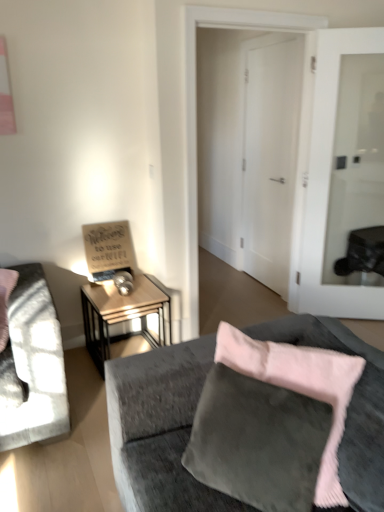
Question: Is wooden sign at left further to camera compared to white glass door at center, the 2th door from the left?

Choices:
 (A) yes
 (B) no

Answer: (A)

Question: Is wooden sign at left outside white glass door at center, the 2th door from the left?

Choices:
 (A) yes
 (B) no

Answer: (A)

Question: Is wooden sign at left positioned before white glass door at center, the 1th door in the right-to-left sequence?

Choices:
 (A) yes
 (B) no

Answer: (B)

Question: Does wooden sign at left have a greater height compared to white glass door at center, the 1th door in the right-to-left sequence?

Choices:
 (A) no
 (B) yes

Answer: (A)

Question: Does wooden sign at left have a lesser height compared to white glass door at center, the 1th door in the right-to-left sequence?

Choices:
 (A) no
 (B) yes

Answer: (B)

Question: From the image's perspective, is wooden side table at center left located above or below white glass door at center, the 2th door from the left?

Choices:
 (A) above
 (B) below

Answer: (B)

Question: Is wooden side table at center left wider or thinner than white glass door at center, the 2th door from the left?

Choices:
 (A) wide
 (B) thin

Answer: (A)

Question: Is point (97, 347) positioned closer to the camera than point (317, 92)?

Choices:
 (A) closer
 (B) farther

Answer: (B)

Question: Relative to white glass door at center, the 2th door from the left, is wooden side table at center left in front or behind?

Choices:
 (A) behind
 (B) front

Answer: (B)

Question: Is white glass door at center, the 1th door in the right-to-left sequence, inside the boundaries of wooden sign at left, or outside?

Choices:
 (A) inside
 (B) outside

Answer: (B)

Question: From a real-world perspective, relative to wooden sign at left, is white glass door at center, the 1th door in the right-to-left sequence, vertically above or below?

Choices:
 (A) above
 (B) below

Answer: (A)

Question: From their relative heights in the image, would you say white glass door at center, the 1th door in the right-to-left sequence, is taller or shorter than wooden sign at left?

Choices:
 (A) tall
 (B) short

Answer: (A)

Question: Looking at the image, does white glass door at center, the 1th door in the right-to-left sequence, seem bigger or smaller compared to wooden sign at left?

Choices:
 (A) big
 (B) small

Answer: (A)

Question: Relative to velvet gray couch at lower right, is metallic silver table lamp at left in front or behind?

Choices:
 (A) behind
 (B) front

Answer: (A)

Question: Considering the positions of point (124, 273) and point (173, 359), is point (124, 273) closer or farther from the camera than point (173, 359)?

Choices:
 (A) farther
 (B) closer

Answer: (A)